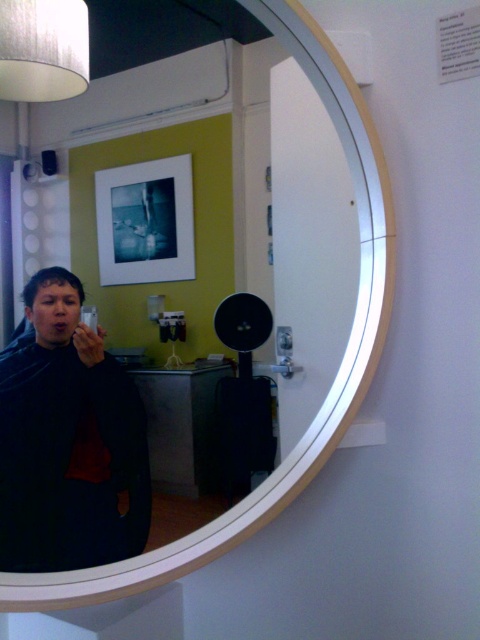
Looking at this image, can you confirm if matte black shirt at left is wider than matte black speaker at center?

Yes, matte black shirt at left is wider than matte black speaker at center.

Is point (38, 388) positioned in front of point (238, 321)?

That is True.

Locate an element on the screen. The image size is (480, 640). matte black shirt at left is located at coordinates (68, 440).